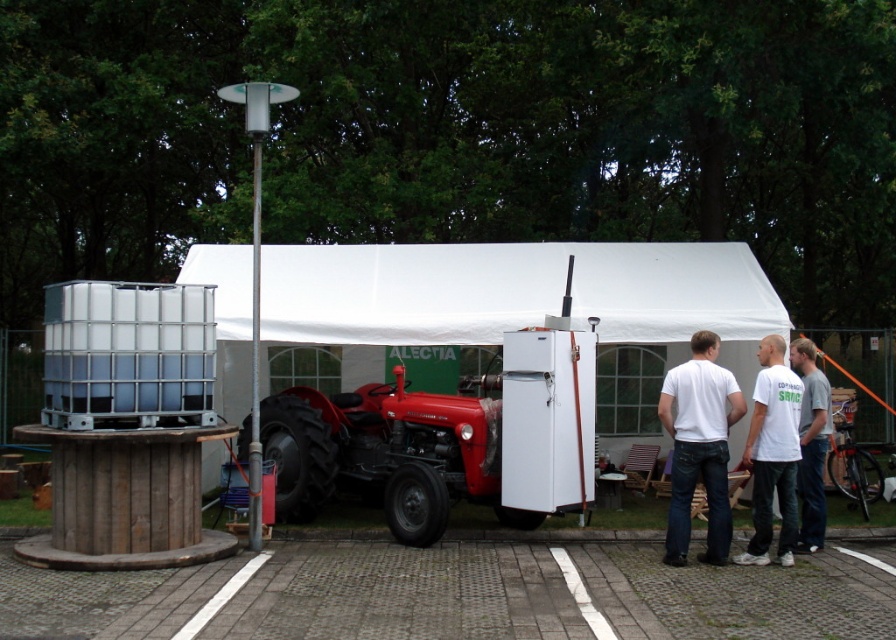
You are standing at the entrance of the white fabric tent at center and want to see the red metal tractor at center. In which direction should you walk?

The white fabric tent at center is to the left of the red metal tractor at center, so you should walk to your right to face the red metal tractor at center.